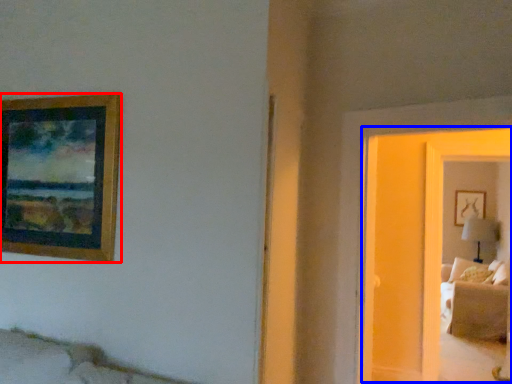
Question: Among these objects, which one is farthest to the camera, picture frame (highlighted by a red box) or glass door (highlighted by a blue box)?

Choices:
 (A) picture frame
 (B) glass door

Answer: (A)